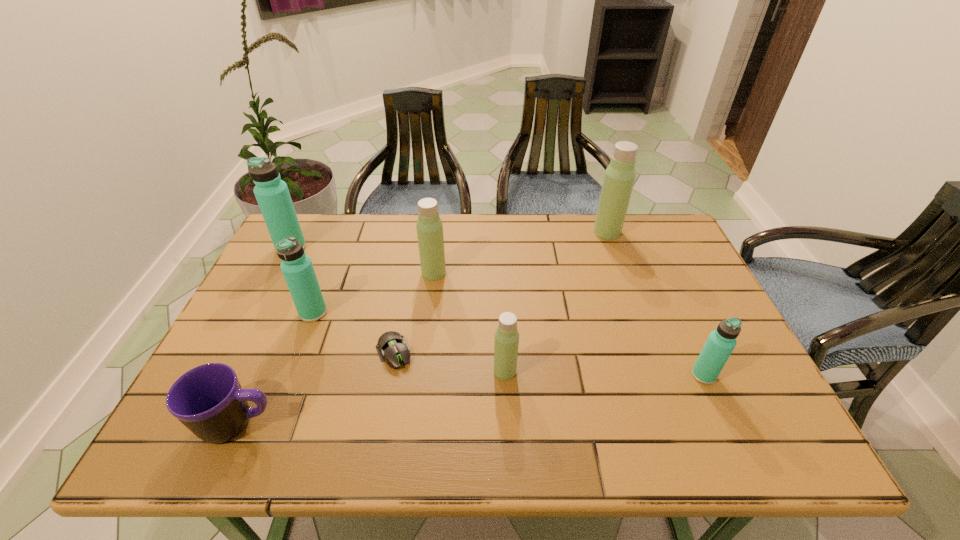
Identify the location of aqua thermos bottle that is the second closest one to the rightmost light thermos bottle. (297, 268).

Find the location of a particular element. The image size is (960, 540). free location that satisfies the following two spatial constraints: 1. on the back side of the computer mouse; 2. on the left side of the rightmost light thermos bottle is located at coordinates click(416, 232).

The height and width of the screenshot is (540, 960). I want to click on free spot that satisfies the following two spatial constraints: 1. on the front side of the rightmost thermos bottle; 2. on the left side of the second object from right to left, so click(x=659, y=375).

The image size is (960, 540). I want to click on free space that satisfies the following two spatial constraints: 1. on the front side of the nearest aqua thermos bottle; 2. with the handle on the side of the nearest object, so click(x=726, y=424).

This screenshot has width=960, height=540. Find the location of `blank space that satisfies the following two spatial constraints: 1. on the front side of the computer mouse; 2. on the left side of the smallest aqua thermos bottle`. blank space that satisfies the following two spatial constraints: 1. on the front side of the computer mouse; 2. on the left side of the smallest aqua thermos bottle is located at coordinates (389, 375).